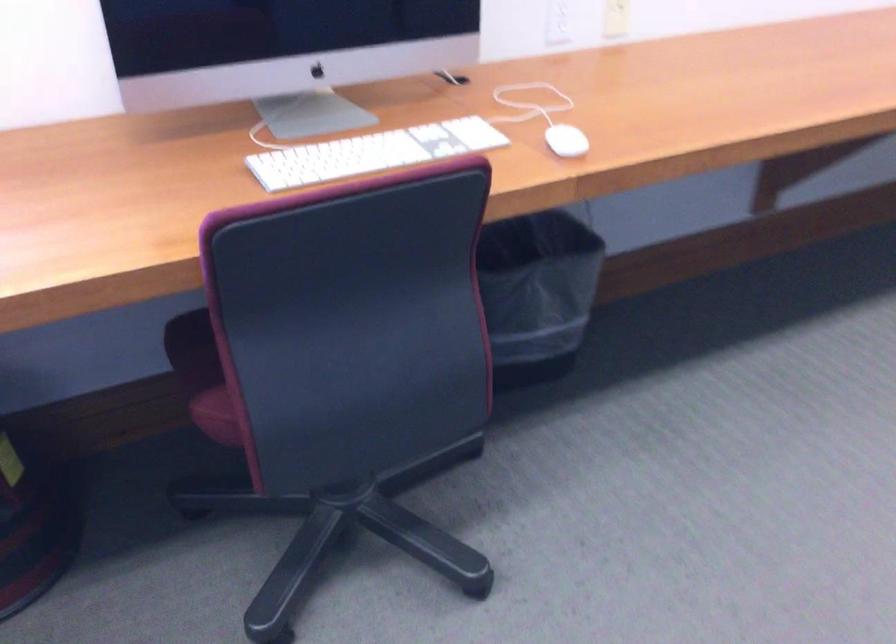
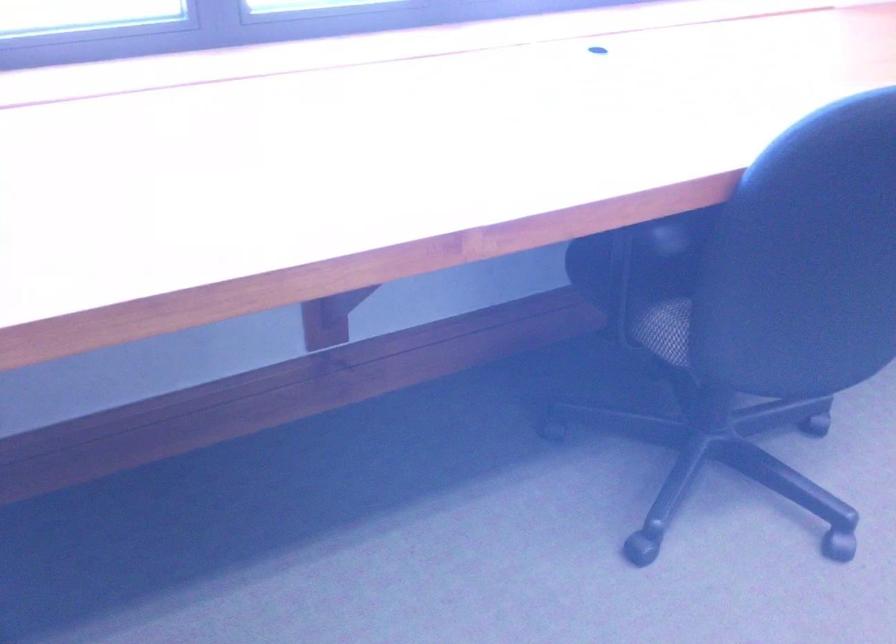
In a continuous first-person perspective shot, in which direction is the camera moving?

The movement direction of the cameraman is left, backward.